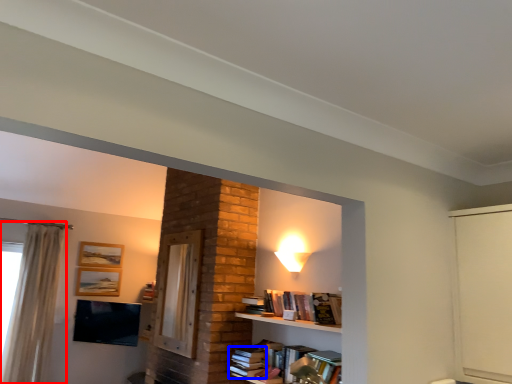
Question: Which object is further to the camera taking this photo, curtain (highlighted by a red box) or book (highlighted by a blue box)?

Choices:
 (A) curtain
 (B) book

Answer: (A)